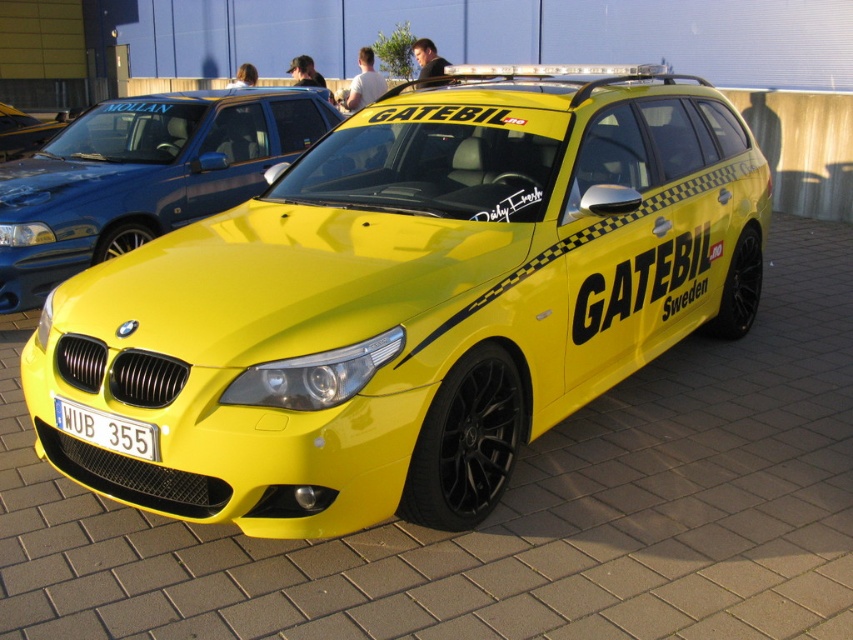
Question: Does white carbon fiber license plate at front have a greater width compared to yellow matte car at center?

Choices:
 (A) no
 (B) yes

Answer: (A)

Question: Which of the following is the farthest from the observer?

Choices:
 (A) glossy yellow car at center
 (B) yellow matte car at center
 (C) yellow glossy car at center
 (D) white carbon fiber license plate at front

Answer: (B)

Question: Can you confirm if yellow glossy car at center is positioned below yellow matte car at center?

Choices:
 (A) no
 (B) yes

Answer: (B)

Question: Is white carbon fiber license plate at front thinner than yellow matte car at center?

Choices:
 (A) yes
 (B) no

Answer: (A)

Question: Estimate the real-world distances between objects in this image. Which object is farther from the yellow matte car at center?

Choices:
 (A) glossy yellow car at center
 (B) yellow glossy car at center
 (C) white carbon fiber license plate at front

Answer: (C)

Question: Estimate the real-world distances between objects in this image. Which object is farther from the glossy yellow car at center?

Choices:
 (A) yellow matte car at center
 (B) yellow glossy car at center

Answer: (A)